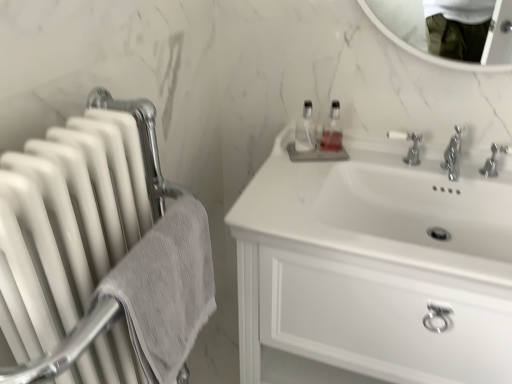
This screenshot has height=384, width=512. What are the coordinates of `vacant space to the left of clear glass bottle at center` in the screenshot? It's located at (280, 156).